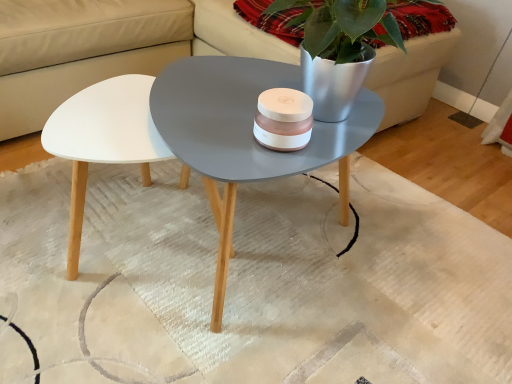
Question: From a real-world perspective, does metallic silver pot at upper right stand above white leather couch at upper center?

Choices:
 (A) yes
 (B) no

Answer: (A)

Question: Is metallic silver pot at upper right positioned beyond the bounds of white leather couch at upper center?

Choices:
 (A) no
 (B) yes

Answer: (A)

Question: Can you confirm if metallic silver pot at upper right is wider than white leather couch at upper center?

Choices:
 (A) no
 (B) yes

Answer: (A)

Question: Does metallic silver pot at upper right contain white leather couch at upper center?

Choices:
 (A) no
 (B) yes

Answer: (A)

Question: From a real-world perspective, is metallic silver pot at upper right beneath white leather couch at upper center?

Choices:
 (A) yes
 (B) no

Answer: (B)

Question: In the image, is white textured rug at center positioned in front of or behind white leather couch at upper center?

Choices:
 (A) behind
 (B) front

Answer: (B)

Question: Is white textured rug at center spatially inside white leather couch at upper center, or outside of it?

Choices:
 (A) outside
 (B) inside

Answer: (A)

Question: From a real-world perspective, is white textured rug at center above or below white leather couch at upper center?

Choices:
 (A) below
 (B) above

Answer: (A)

Question: From the image's perspective, is white textured rug at center positioned above or below white leather couch at upper center?

Choices:
 (A) below
 (B) above

Answer: (A)

Question: Based on their sizes in the image, would you say metallic silver pot at upper right is bigger or smaller than white textured rug at center?

Choices:
 (A) small
 (B) big

Answer: (A)

Question: Is metallic silver pot at upper right wider or thinner than white textured rug at center?

Choices:
 (A) thin
 (B) wide

Answer: (A)

Question: Is metallic silver pot at upper right in front of or behind white textured rug at center in the image?

Choices:
 (A) behind
 (B) front

Answer: (A)

Question: Would you say metallic silver pot at upper right is inside or outside white textured rug at center?

Choices:
 (A) inside
 (B) outside

Answer: (B)

Question: From a real-world perspective, relative to white leather couch at upper center, is metallic silver pot at upper right vertically above or below?

Choices:
 (A) above
 (B) below

Answer: (A)

Question: Considering their positions, is metallic silver pot at upper right located in front of or behind white leather couch at upper center?

Choices:
 (A) front
 (B) behind

Answer: (B)